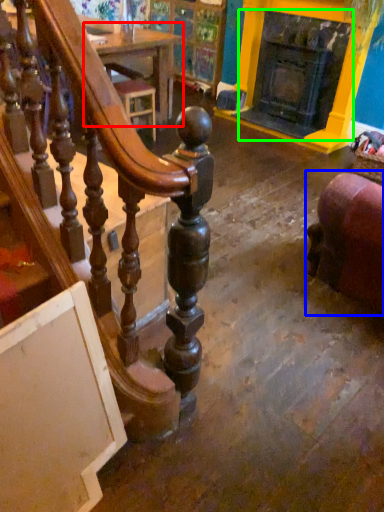
Question: Which object is the farthest from table (highlighted by a red box)? Choose among these: furniture (highlighted by a blue box) or fireplace (highlighted by a green box).

Choices:
 (A) furniture
 (B) fireplace

Answer: (A)